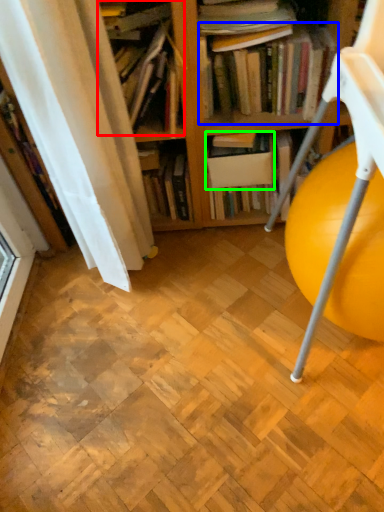
Question: Based on their relative distances, which object is nearer to book (highlighted by a red box)? Choose from book (highlighted by a blue box) and paperback book (highlighted by a green box).

Choices:
 (A) book
 (B) paperback book

Answer: (A)